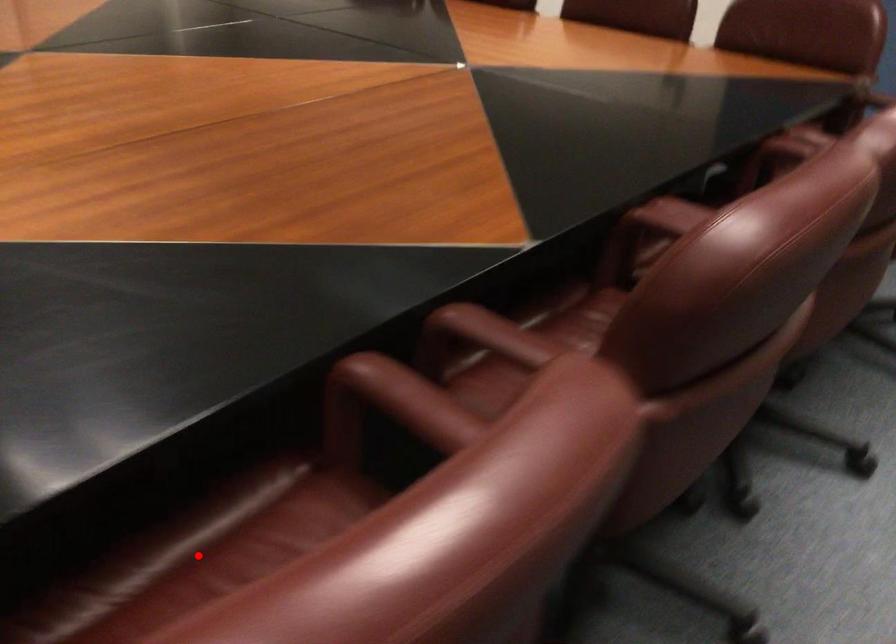
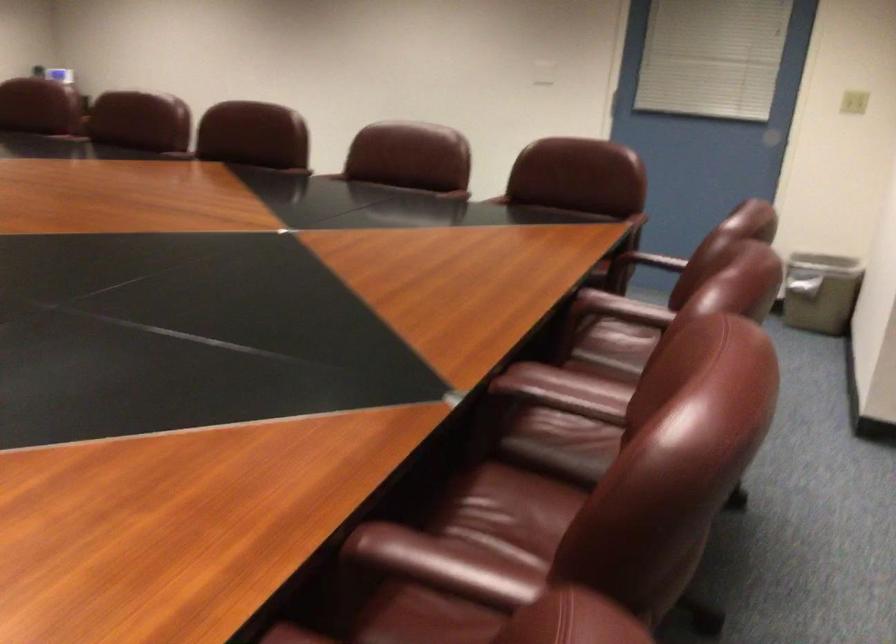
Question: I am providing you with two images of the same scene from different viewpoints. A red point is marked on the first image. Is the red point's position out of view in image 2?

Choices:
 (A) Yes
 (B) No

Answer: (A)